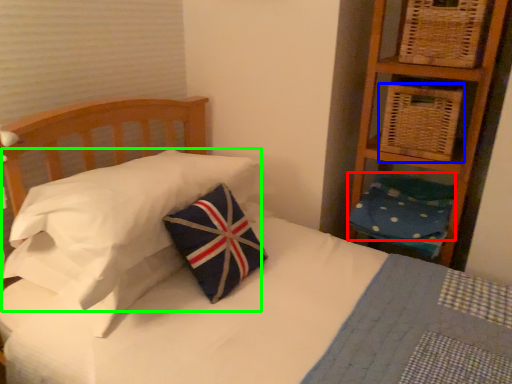
Question: Which is nearer to the pillow (highlighted by a red box)? basket (highlighted by a blue box) or pillow (highlighted by a green box).

Choices:
 (A) basket
 (B) pillow

Answer: (A)